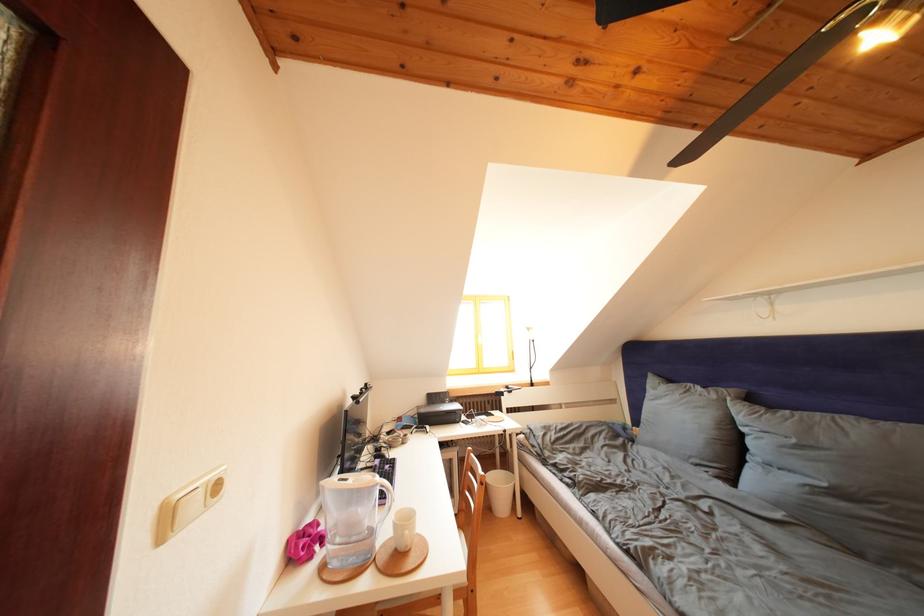
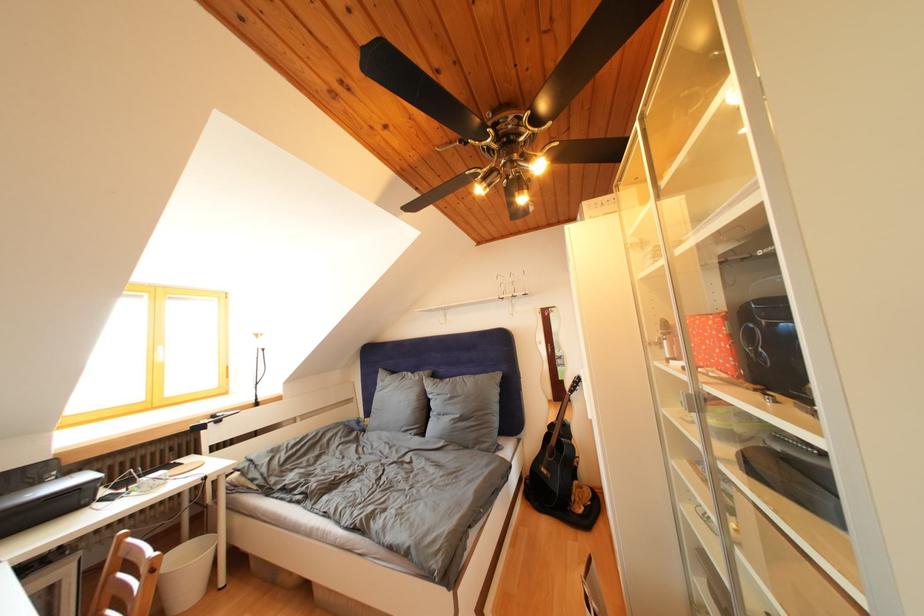
Where in the second image is the point corresponding to pixel 677 386 from the first image?

(400, 378)